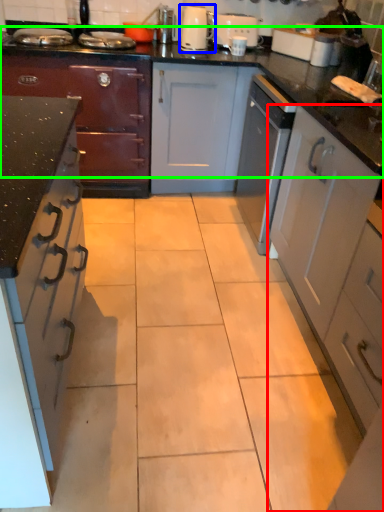
Question: Which is nearer to the cabinetry (highlighted by a red box)? kitchen appliance (highlighted by a blue box) or countertop (highlighted by a green box).

Choices:
 (A) kitchen appliance
 (B) countertop

Answer: (B)